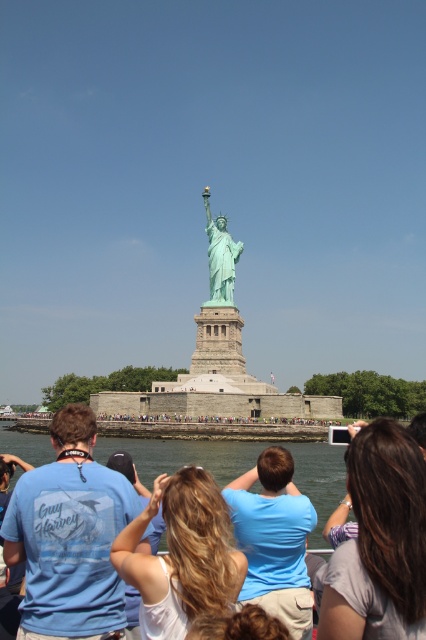
Question: Based on their relative distances, which object is farther from the white matte hair at center?

Choices:
 (A) brown hair at lower center
 (B) gray fabric shirt at lower right
 (C) white matte camera at center

Answer: (B)

Question: Which point appears closest to the camera in this image?

Choices:
 (A) (120, 564)
 (B) (117, 589)
 (C) (224, 256)
 (D) (158, 538)

Answer: (A)

Question: Is light blue t-shirt at center positioned behind white matte camera at center?

Choices:
 (A) no
 (B) yes

Answer: (B)

Question: Is white matte hair at center wider than white matte camera at center?

Choices:
 (A) yes
 (B) no

Answer: (B)

Question: Considering the relative positions of light blue t-shirt at center and clear water at lower center in the image provided, where is light blue t-shirt at center located with respect to clear water at lower center?

Choices:
 (A) below
 (B) above

Answer: (B)

Question: Which point is farther from the camera taking this photo?

Choices:
 (A) (302, 480)
 (B) (89, 616)
 (C) (218, 224)

Answer: (C)